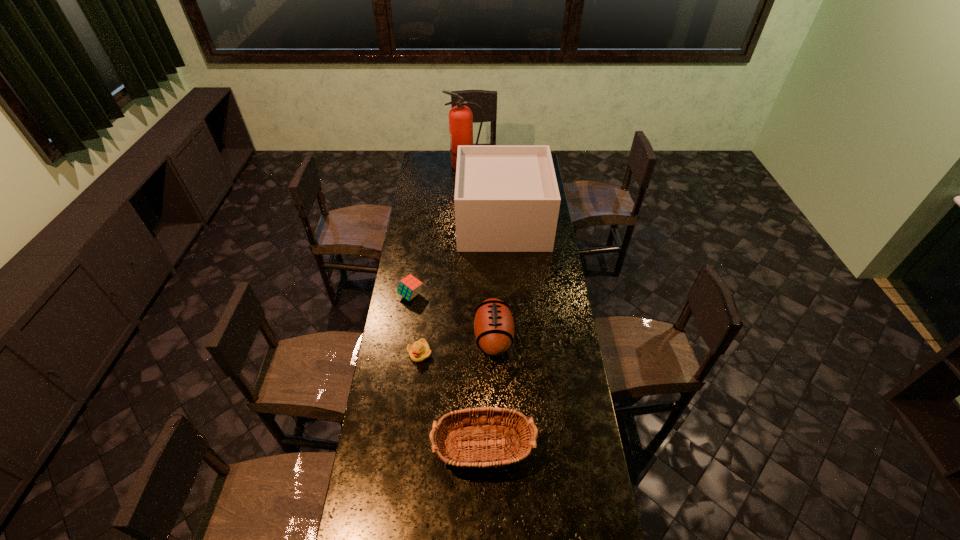
At what (x,y) coordinates should I click in order to perform the action: click on fire extinguisher. Please return your answer as a coordinate pair (x, y). Image resolution: width=960 pixels, height=540 pixels. Looking at the image, I should click on (460, 117).

Identify the location of the tallest object. The image size is (960, 540). (460, 117).

The width and height of the screenshot is (960, 540). I want to click on the fifth nearest object, so click(x=507, y=199).

Identify the location of the second tallest object. This screenshot has width=960, height=540. (507, 199).

Locate an element on the screen. The image size is (960, 540). basket is located at coordinates (514, 449).

I want to click on football (American), so click(x=493, y=325).

This screenshot has width=960, height=540. Identify the location of the third farthest object. [x=409, y=287].

This screenshot has height=540, width=960. In order to click on the fifth tallest object in this screenshot , I will do [x=409, y=287].

You are a GUI agent. You are given a task and a screenshot of the screen. Output one action in this format:
    pyautogui.click(x=<x>, y=<y>)
    Task: Click on the shortest object
    This screenshot has width=960, height=540.
    Given the screenshot: What is the action you would take?
    pyautogui.click(x=419, y=351)

You are a GUI agent. You are given a task and a screenshot of the screen. Output one action in this format:
    pyautogui.click(x=<x>, y=<y>)
    Task: Click on the vacant space located on the nozzle of the farthest object
    
    Given the screenshot: What is the action you would take?
    pyautogui.click(x=499, y=166)